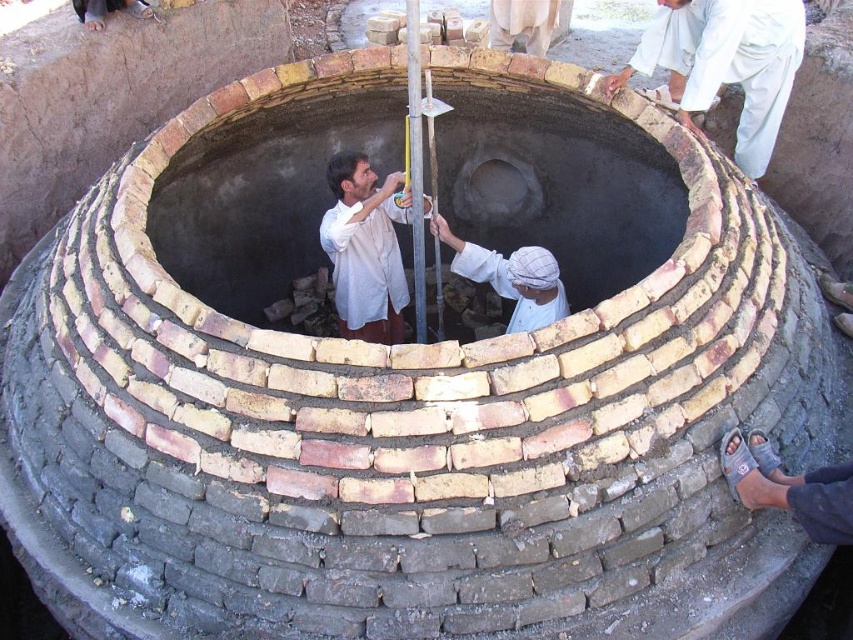
Question: In this image, where is brown leather sandal at lower right located relative to white cloth at center?

Choices:
 (A) above
 (B) below

Answer: (B)

Question: Can you confirm if brick oven at center is wider than brown leather sandal at lower right?

Choices:
 (A) no
 (B) yes

Answer: (B)

Question: Which point appears closest to the camera in this image?

Choices:
 (A) (370, 310)
 (B) (509, 144)
 (C) (541, 278)
 (D) (799, 488)

Answer: (D)

Question: Is brown leather sandal at lower right further to camera compared to white cloth at center?

Choices:
 (A) no
 (B) yes

Answer: (A)

Question: Among these points, which one is nearest to the camera?

Choices:
 (A) (401, 291)
 (B) (532, 289)
 (C) (595, 196)

Answer: (B)

Question: Which object is positioned farthest from the white cloth at center?

Choices:
 (A) brown leather sandal at lower right
 (B) white matte shirt at center
 (C) white cotton shirt at upper right

Answer: (C)